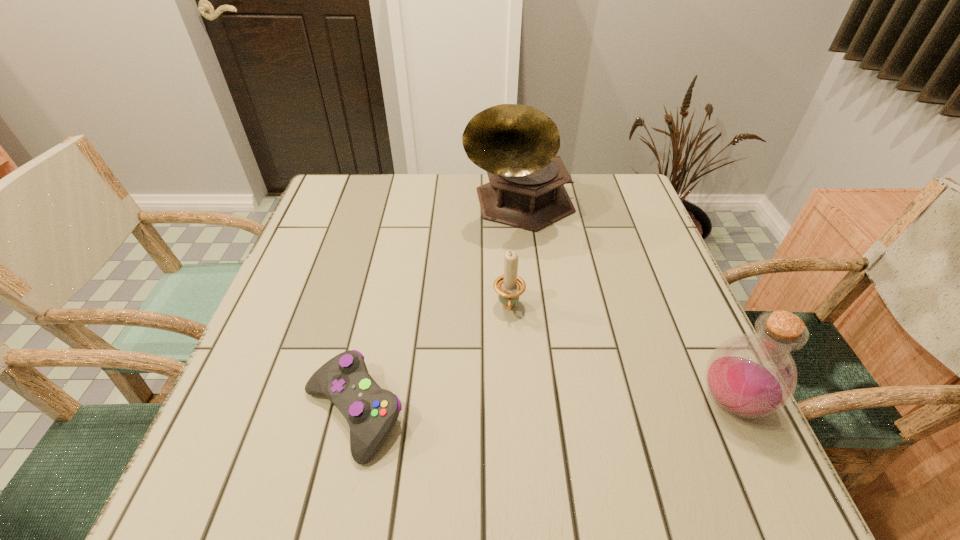
You are a GUI agent. You are given a task and a screenshot of the screen. Output one action in this format:
    pyautogui.click(x=<x>, y=<y>)
    Task: Click on the control
    This screenshot has height=540, width=960.
    Given the screenshot: What is the action you would take?
    pyautogui.click(x=371, y=412)

The width and height of the screenshot is (960, 540). Find the location of `the leftmost object`. the leftmost object is located at coordinates (371, 412).

The image size is (960, 540). I want to click on bottle, so click(753, 375).

Image resolution: width=960 pixels, height=540 pixels. I want to click on the third shortest object, so click(x=753, y=375).

Locate an element on the screen. This screenshot has width=960, height=540. the second shortest object is located at coordinates (509, 287).

Identify the location of the third nearest object. (509, 287).

The width and height of the screenshot is (960, 540). What are the coordinates of `the farthest object` in the screenshot? It's located at (516, 144).

Locate an element on the screen. The height and width of the screenshot is (540, 960). phonograph record is located at coordinates (516, 144).

Find the location of `vacant point located on the right of the control`. vacant point located on the right of the control is located at coordinates (435, 413).

Where is `vacant area situated on the back of the rightmost object`? This screenshot has width=960, height=540. vacant area situated on the back of the rightmost object is located at coordinates (704, 342).